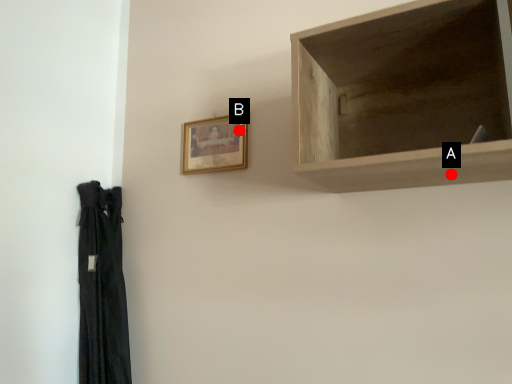
Question: Two points are circled on the image, labeled by A and B beside each circle. Which point is farther from the camera taking this photo?

Choices:
 (A) A is further
 (B) B is further

Answer: (B)